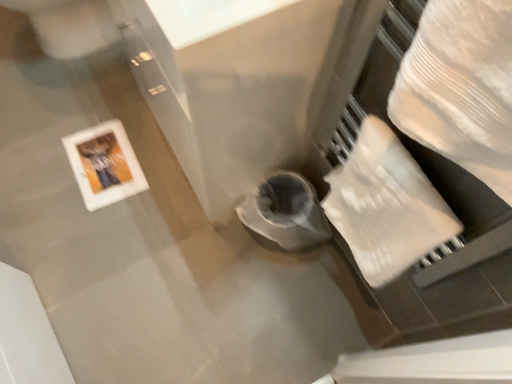
What are the coordinates of `free space in front of white glossy picture frame at upper left` in the screenshot? It's located at (84, 230).